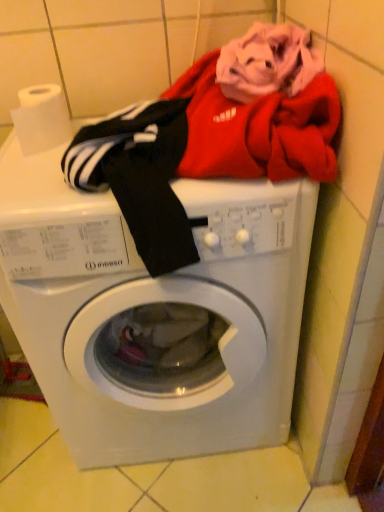
Question: Considering the relative positions of white plastic washing machine at center and white matte toilet paper at upper left in the image provided, is white plastic washing machine at center to the left or to the right of white matte toilet paper at upper left?

Choices:
 (A) left
 (B) right

Answer: (B)

Question: From the image's perspective, relative to white matte toilet paper at upper left, is white plastic washing machine at center above or below?

Choices:
 (A) below
 (B) above

Answer: (A)

Question: Considering the positions of white plastic washing machine at center and white matte toilet paper at upper left in the image, is white plastic washing machine at center taller or shorter than white matte toilet paper at upper left?

Choices:
 (A) tall
 (B) short

Answer: (A)

Question: Looking at the image, does white matte toilet paper at upper left seem bigger or smaller compared to white plastic washing machine at center?

Choices:
 (A) small
 (B) big

Answer: (A)

Question: Relative to white plastic washing machine at center, is white matte toilet paper at upper left in front or behind?

Choices:
 (A) behind
 (B) front

Answer: (A)

Question: Is white matte toilet paper at upper left to the left or to the right of white plastic washing machine at center in the image?

Choices:
 (A) right
 (B) left

Answer: (B)

Question: Is point (51, 115) closer or farther from the camera than point (218, 289)?

Choices:
 (A) closer
 (B) farther

Answer: (B)